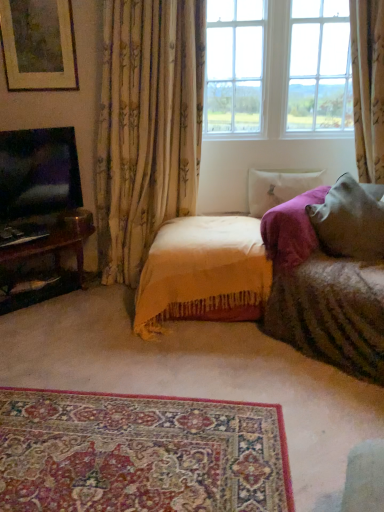
Question: From the image's perspective, is velvet yellow blanket at center positioned above or below floral fabric curtain at left?

Choices:
 (A) above
 (B) below

Answer: (B)

Question: Choose the correct answer: Is velvet yellow blanket at center inside floral fabric curtain at left or outside it?

Choices:
 (A) outside
 (B) inside

Answer: (A)

Question: Estimate the real-world distances between objects in this image. Which object is farther from the carpet with intricate patterns at lower center?

Choices:
 (A) velvet yellow blanket at center
 (B) matte gold picture frame at upper left
 (C) white soft pillow at upper right, the 1th pillow when ordered from back to front
 (D) matte black tv at left
 (E) soft gray pillow at right, placed as the 2th pillow when sorted from back to front

Answer: (B)

Question: Based on their relative distances, which object is nearer to the floral fabric curtain at left?

Choices:
 (A) velvet yellow blanket at center
 (B) clear glass window at upper center
 (C) matte gold picture frame at upper left
 (D) soft gray pillow at right, the 1th pillow when ordered from front to back
 (E) carpet with intricate patterns at lower center

Answer: (C)